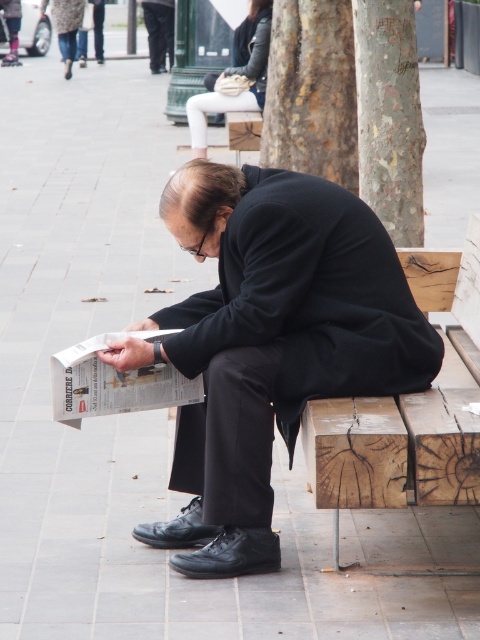
Question: Which of the following is the farthest from the observer?

Choices:
 (A) leather jacket at upper center
 (B) dark gray fabric pants at lower center
 (C) wooden bench at lower right

Answer: (B)

Question: Considering the relative positions of smooth bark tree at upper right and dark gray fabric pants at lower center in the image provided, where is smooth bark tree at upper right located with respect to dark gray fabric pants at lower center?

Choices:
 (A) right
 (B) left

Answer: (A)

Question: Is black matte coat at center thinner than black fabric pants at upper center?

Choices:
 (A) yes
 (B) no

Answer: (B)

Question: Which object appears farthest from the camera in this image?

Choices:
 (A) black matte coat at center
 (B) smooth bark tree at upper center
 (C) wooden bench at lower right
 (D) leather jacket at upper center

Answer: (D)

Question: Which point appears farthest from the camera in this image?

Choices:
 (A) (84, 65)
 (B) (245, 410)

Answer: (A)

Question: Is leather jacket at upper center thinner than dark gray fabric pants at lower center?

Choices:
 (A) yes
 (B) no

Answer: (B)